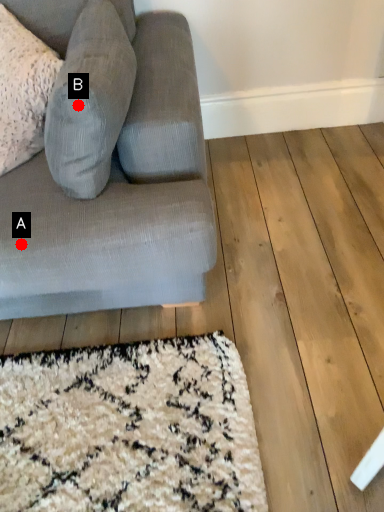
Question: Two points are circled on the image, labeled by A and B beside each circle. Which point appears farthest from the camera in this image?

Choices:
 (A) A is further
 (B) B is further

Answer: (A)